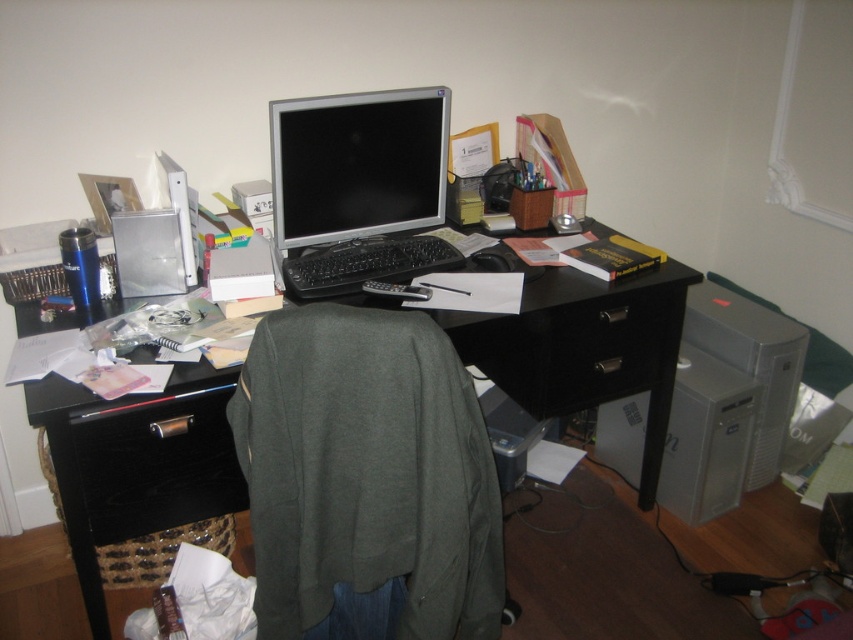
You are a delivery person who needs to place a small package on the desk without moving any items. The package is 1 foot in length. Is there enough space between the silver metallic monitor at center and the edge of the desk to place it?

The distance between the silver metallic monitor at center and the camera is 5.83 feet, but the question is about the distance between the monitor and the edge of the desk. Since the camera angle and desk dimensions arenanot provided, we cannot determine if there is enough space. Please check the desk layout or move items to accommodate the package.

You are organizing the desk and need to place a new item between the silver metallic monitor at center and the black plastic drawer at center. Given their sizes, which object should you place closer to the edge of the desk to save space?

Since the silver metallic monitor at center is larger than the black plastic drawer at center, you should place the black plastic drawer at center closer to the edge of the desk to save space.